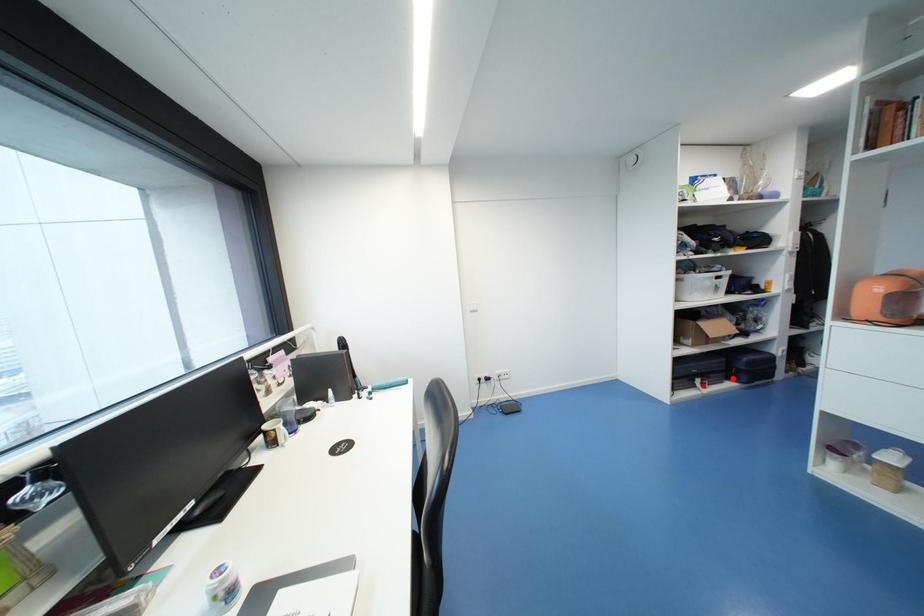
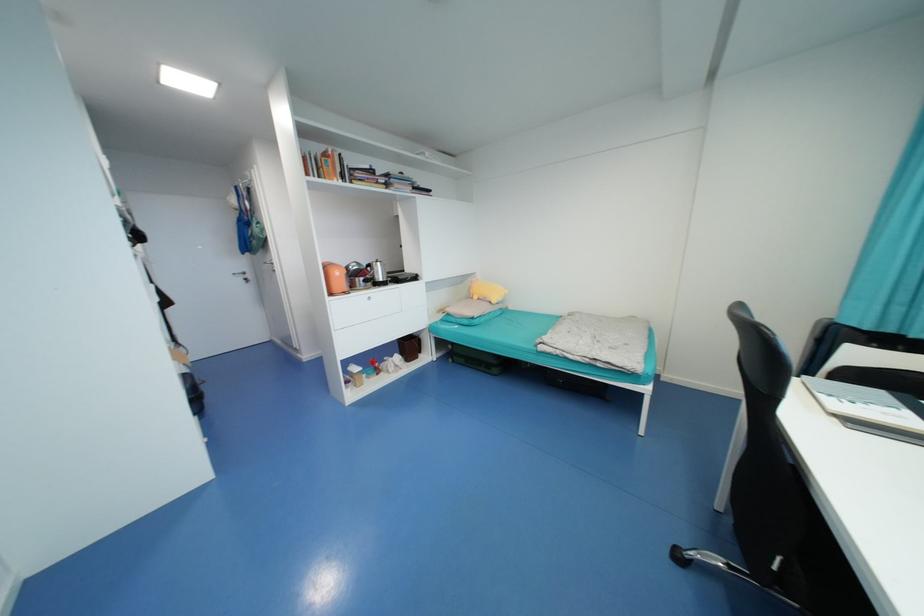
Question: I am providing you with two images of the same scene from different viewpoints. A red point is marked on the first image. Can you still see the location of the red point in image 2?

Choices:
 (A) Yes
 (B) No

Answer: (B)